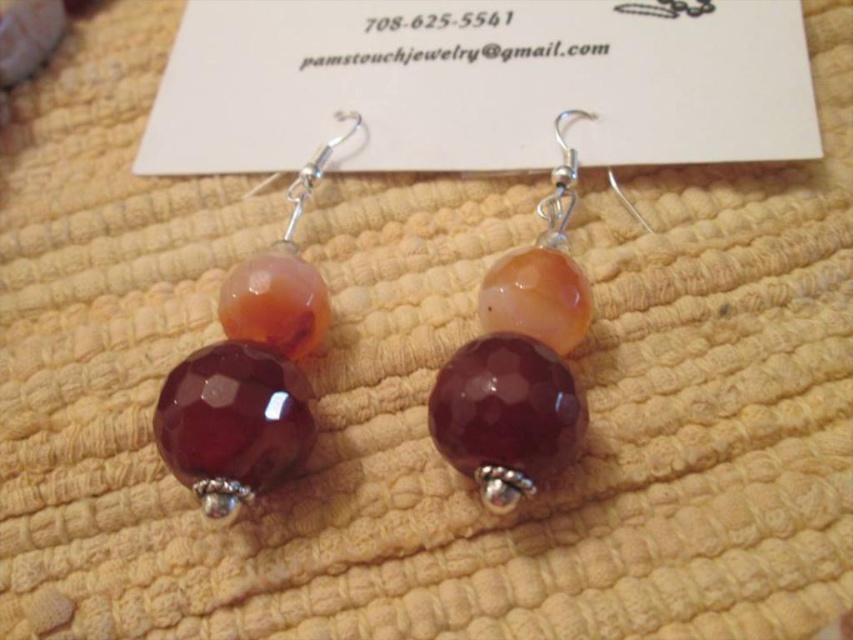
Who is more distant from viewer, (241, 323) or (445, 424)?

Positioned behind is point (241, 323).

Is point (227, 408) more distant than point (538, 344)?

No.

Which is in front, point (212, 396) or point (511, 408)?

Point (511, 408) is in front.

The height and width of the screenshot is (640, 853). What are the coordinates of `faceted glass bead at left` in the screenshot? It's located at (251, 369).

Is faceted glass bead at left wider than faceted purple glass bead at center?

Yes.

Does faceted glass bead at left appear under faceted purple glass bead at center?

Actually, faceted glass bead at left is above faceted purple glass bead at center.

Does point (235, 436) come farther from viewer compared to point (584, 404)?

No, it is in front of (584, 404).

Image resolution: width=853 pixels, height=640 pixels. I want to click on faceted glass bead at left, so click(251, 369).

Between matte orange bead at center and faceted purple glass bead at center, which one has less height?

Standing shorter between the two is faceted purple glass bead at center.

Consider the image. Does matte orange bead at center appear on the right side of faceted purple glass bead at center?

Correct, you'll find matte orange bead at center to the right of faceted purple glass bead at center.

Which is in front, point (537, 365) or point (491, 394)?

Point (491, 394) is in front.

Locate an element on the screen. matte orange bead at center is located at coordinates (519, 353).